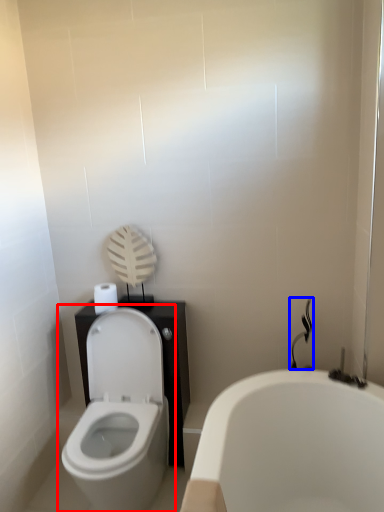
Question: Which point is further to the camera, toilet (highlighted by a red box) or shower (highlighted by a blue box)?

Choices:
 (A) toilet
 (B) shower

Answer: (B)